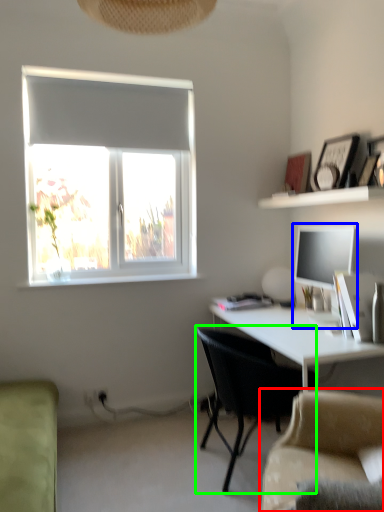
Question: Considering the real-world distances, which object is closest to studio couch (highlighted by a red box)? desktop computer (highlighted by a blue box) or chair (highlighted by a green box).

Choices:
 (A) desktop computer
 (B) chair

Answer: (B)